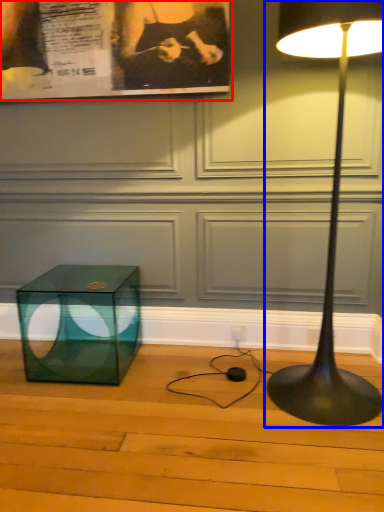
Question: Among these objects, which one is farthest to the camera, poster page (highlighted by a red box) or lamp (highlighted by a blue box)?

Choices:
 (A) poster page
 (B) lamp

Answer: (A)